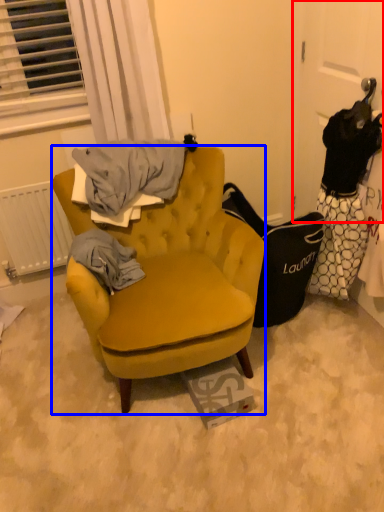
Question: Which object is further to the camera taking this photo, door (highlighted by a red box) or chair (highlighted by a blue box)?

Choices:
 (A) door
 (B) chair

Answer: (A)